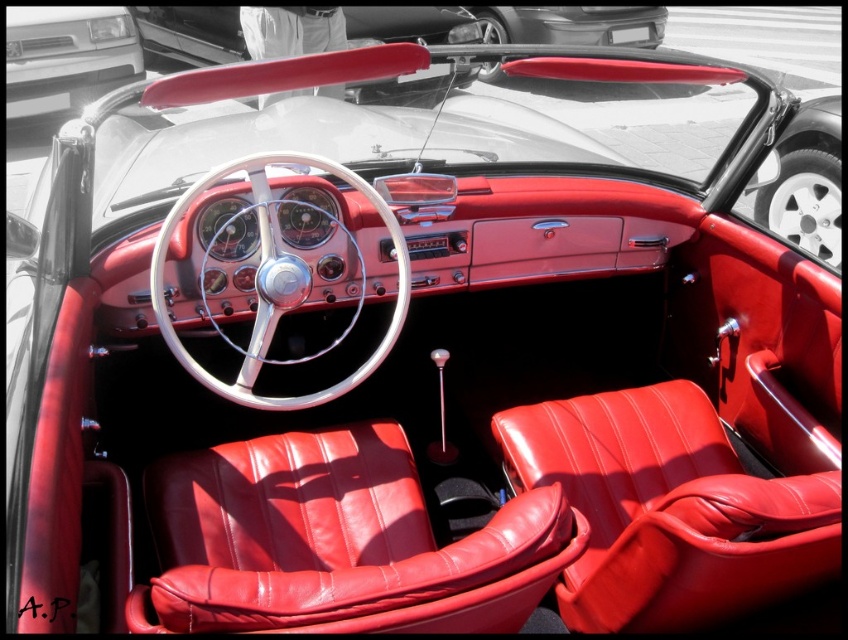
Question: Among these points, which one is nearest to the camera?

Choices:
 (A) (243, 388)
 (B) (581, 404)
 (C) (378, 536)
 (D) (59, 22)

Answer: (C)

Question: Which object is the closest to the shiny leather seat at center?

Choices:
 (A) matte silver bumper at upper left
 (B) polished chrome steering wheel at center

Answer: (B)

Question: Does leather seat at center appear over shiny leather seat at center?

Choices:
 (A) no
 (B) yes

Answer: (A)

Question: Which of the following is the closest to the observer?

Choices:
 (A) (710, 497)
 (B) (176, 353)
 (C) (81, 106)
 (D) (224, 624)

Answer: (D)

Question: Considering the relative positions of polished chrome steering wheel at center and matte silver bumper at upper left in the image provided, where is polished chrome steering wheel at center located with respect to matte silver bumper at upper left?

Choices:
 (A) left
 (B) right

Answer: (B)

Question: Is the position of leather seat at center less distant than that of matte silver bumper at upper left?

Choices:
 (A) yes
 (B) no

Answer: (A)